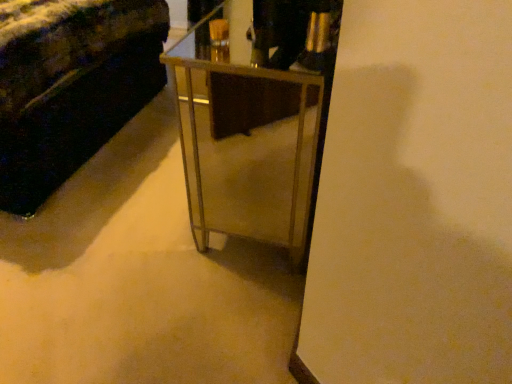
Question: Is metallic gold table at center wider or thinner than velvet dark green couch at left?

Choices:
 (A) thin
 (B) wide

Answer: (A)

Question: From a real-world perspective, is metallic gold table at center physically located above or below velvet dark green couch at left?

Choices:
 (A) below
 (B) above

Answer: (A)

Question: Is point (271, 36) closer or farther from the camera than point (147, 64)?

Choices:
 (A) farther
 (B) closer

Answer: (B)

Question: Is velvet dark green couch at left taller or shorter than metallic gold table at center?

Choices:
 (A) tall
 (B) short

Answer: (A)

Question: Looking at their shapes, would you say velvet dark green couch at left is wider or thinner than metallic gold table at center?

Choices:
 (A) wide
 (B) thin

Answer: (A)

Question: Which is correct: velvet dark green couch at left is inside metallic gold table at center, or outside of it?

Choices:
 (A) outside
 (B) inside

Answer: (A)

Question: From the image's perspective, is velvet dark green couch at left above or below metallic gold table at center?

Choices:
 (A) above
 (B) below

Answer: (A)